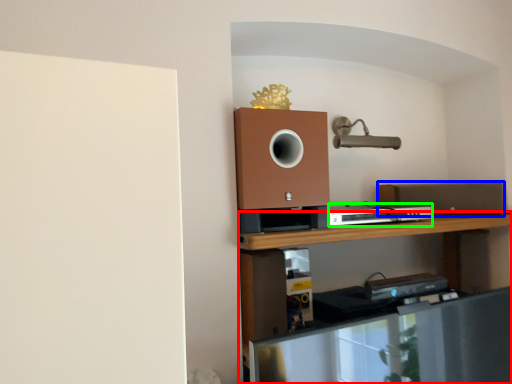
Question: Considering the real-world distances, which object is farthest from shelf (highlighted by a red box)? speaker (highlighted by a blue box) or appliance (highlighted by a green box)?

Choices:
 (A) speaker
 (B) appliance

Answer: (A)